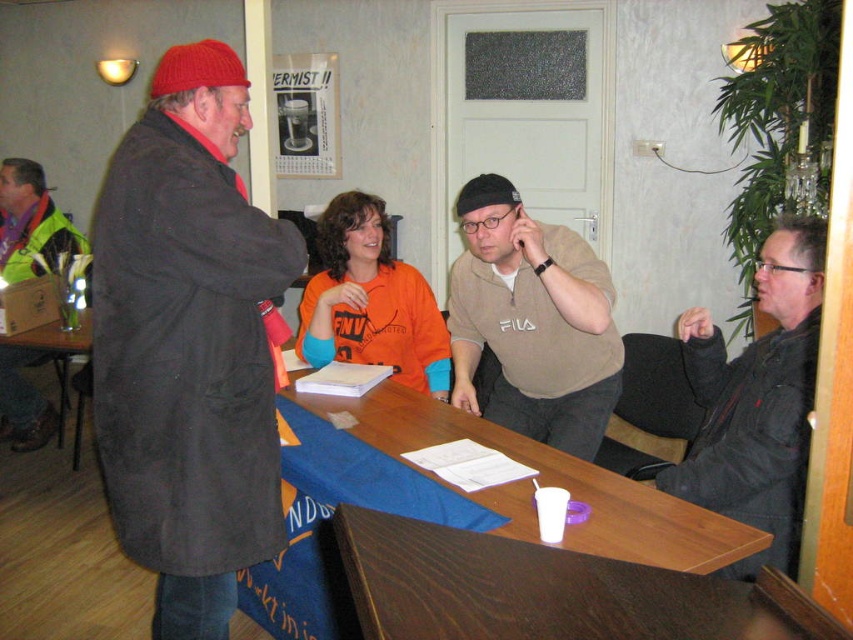
Which is above, matte black coat at left or green reflective jacket at left?

green reflective jacket at left

Who is positioned more to the right, matte black coat at left or green reflective jacket at left?

matte black coat at left is more to the right.

Who is more forward, (132, 502) or (56, 241)?

Point (132, 502)

Locate an element on the screen. matte black coat at left is located at coordinates (189, 342).

Does wooden table at center appear on the right side of beige cotton shirt at center?

No, wooden table at center is not to the right of beige cotton shirt at center.

Can you confirm if wooden table at center is bigger than beige cotton shirt at center?

Indeed, wooden table at center has a larger size compared to beige cotton shirt at center.

Consider the image. Who is more distant from viewer, (473, 502) or (525, 394)?

Positioned behind is point (525, 394).

The image size is (853, 640). I want to click on wooden table at center, so click(419, 506).

Which is behind, point (730, 456) or point (48, 259)?

Positioned behind is point (48, 259).

Which is in front, point (728, 500) or point (3, 216)?

Point (728, 500) is more forward.

Where is `black leather jacket at right`? black leather jacket at right is located at coordinates pos(757,401).